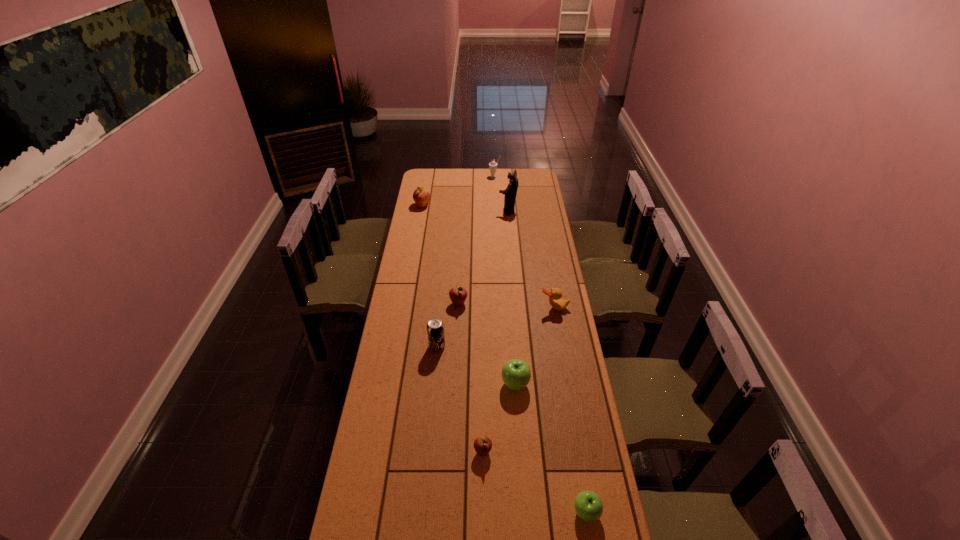
Find the location of `free spot that satisfies the following two spatial constraints: 1. on the front-facing side of the nearest apple; 2. on the right side of the figurine`. free spot that satisfies the following two spatial constraints: 1. on the front-facing side of the nearest apple; 2. on the right side of the figurine is located at coordinates (533, 512).